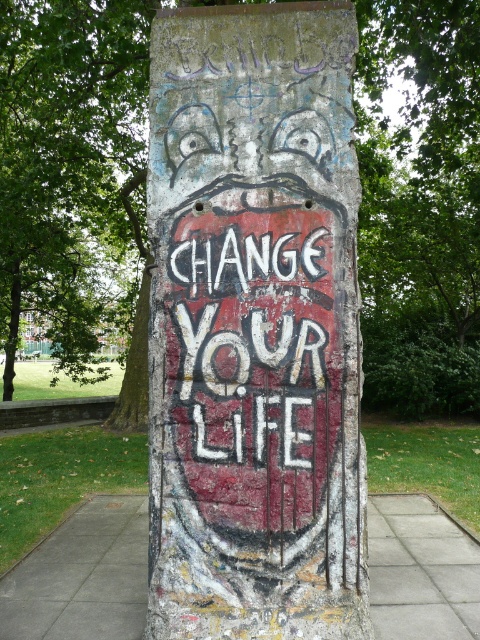
Which of these two, white chalk text at center or gray concrete pavement at center, stands taller?

With more height is white chalk text at center.

Is point (280, 285) farther from camera compared to point (448, 627)?

No, it is not.

Locate an element on the screen. The height and width of the screenshot is (640, 480). white chalk text at center is located at coordinates coord(252,342).

Is green leafy tree at center thinner than gray concrete pavement at center?

Yes, green leafy tree at center is thinner than gray concrete pavement at center.

Is the position of green leafy tree at center less distant than that of gray concrete pavement at center?

No.

Does point (52, 97) come farther from viewer compared to point (429, 545)?

Yes, it is.

Where is `green leafy tree at center`? This screenshot has width=480, height=640. green leafy tree at center is located at coordinates (420, 204).

Does point (210, 256) come closer to viewer compared to point (384, 76)?

Yes.

Between point (255, 124) and point (106, 60), which one is positioned in front?

Point (255, 124)

The width and height of the screenshot is (480, 640). What are the coordinates of `grungy concrete pillar at center` in the screenshot? It's located at (254, 326).

This screenshot has height=640, width=480. What are the coordinates of `grungy concrete pillar at center` in the screenshot? It's located at coord(254,326).